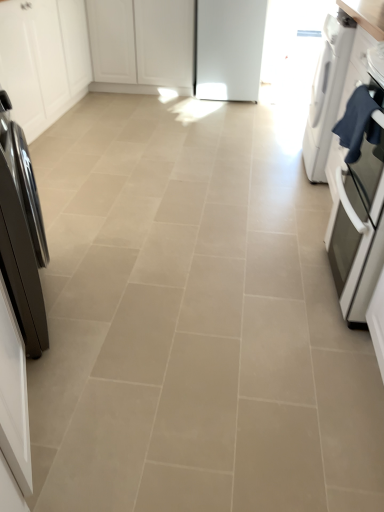
Where is `vacant area that lies between matte stainless steel oven at right and shiny black refrigerator at left, the 1th home appliance from the left`? The width and height of the screenshot is (384, 512). vacant area that lies between matte stainless steel oven at right and shiny black refrigerator at left, the 1th home appliance from the left is located at coordinates (193, 293).